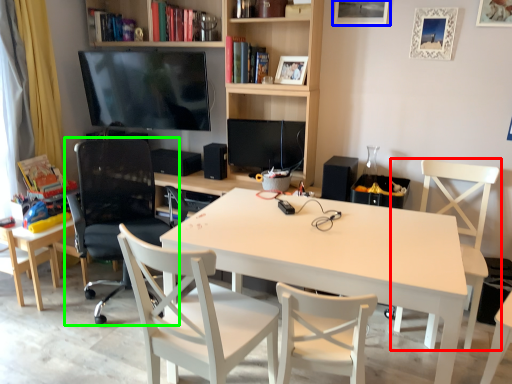
Question: Which object is the closest to the chair (highlighted by a red box)? Choose among these: picture frame (highlighted by a blue box) or chair (highlighted by a green box).

Choices:
 (A) picture frame
 (B) chair

Answer: (A)